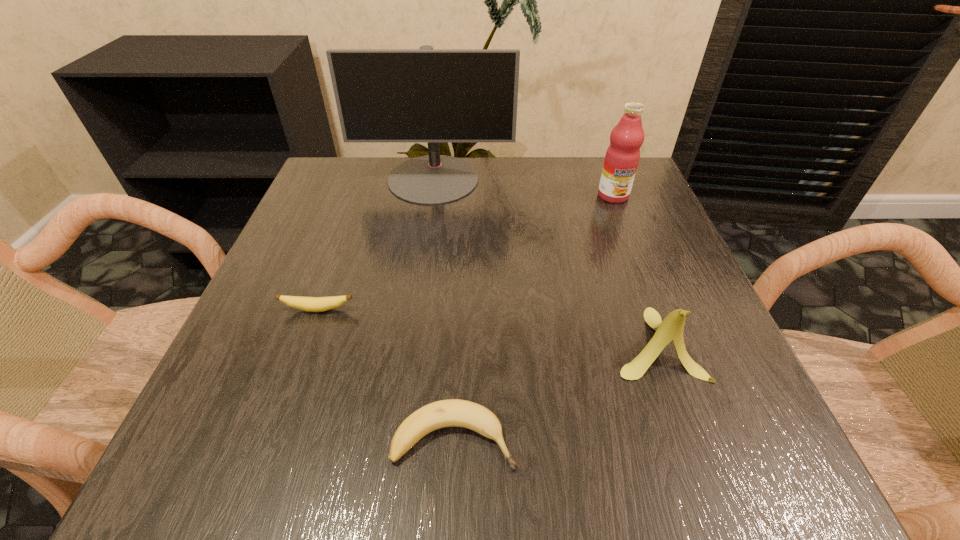
Point out which banana is positioned as the second nearest to the tallest banana. Please provide its 2D coordinates. Your answer should be formatted as a tuple, i.e. [(x, y)], where the tuple contains the x and y coordinates of a point satisfying the conditions above.

[(311, 304)]

Locate an element on the screen. The image size is (960, 540). vacant space that satisfies the following two spatial constraints: 1. on the front side of the tallest banana; 2. at the stem of the nearest object is located at coordinates (689, 439).

The height and width of the screenshot is (540, 960). In order to click on free space that satisfies the following two spatial constraints: 1. on the screen of the tallest banana; 2. on the right side of the computer monitor in this screenshot , I will do `click(410, 343)`.

At what (x,y) coordinates should I click in order to perform the action: click on vacant space that satisfies the following two spatial constraints: 1. on the label of the second tallest object; 2. at the stem of the second banana from right to left. Please return your answer as a coordinate pair (x, y). The image size is (960, 540). Looking at the image, I should click on (707, 439).